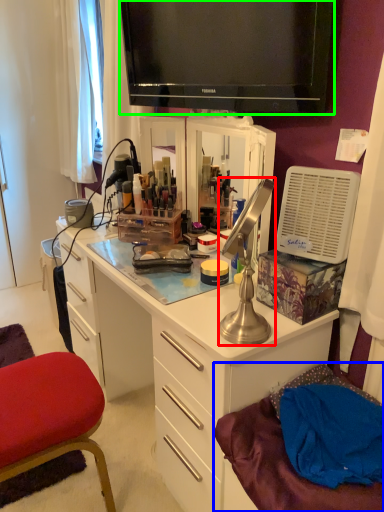
Question: Which object is positioned closest to lamp (highlighted by a red box)? Select from wide (highlighted by a blue box) and television (highlighted by a green box).

Choices:
 (A) wide
 (B) television

Answer: (A)